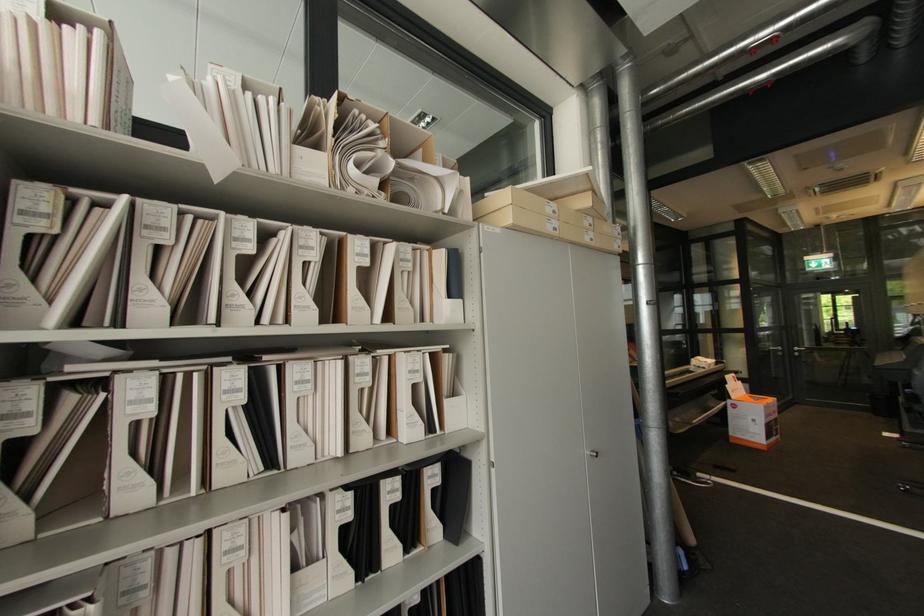
Describe the element at coordinates (592, 453) in the screenshot. The image size is (924, 616). I see `the grey cabinet handle` at that location.